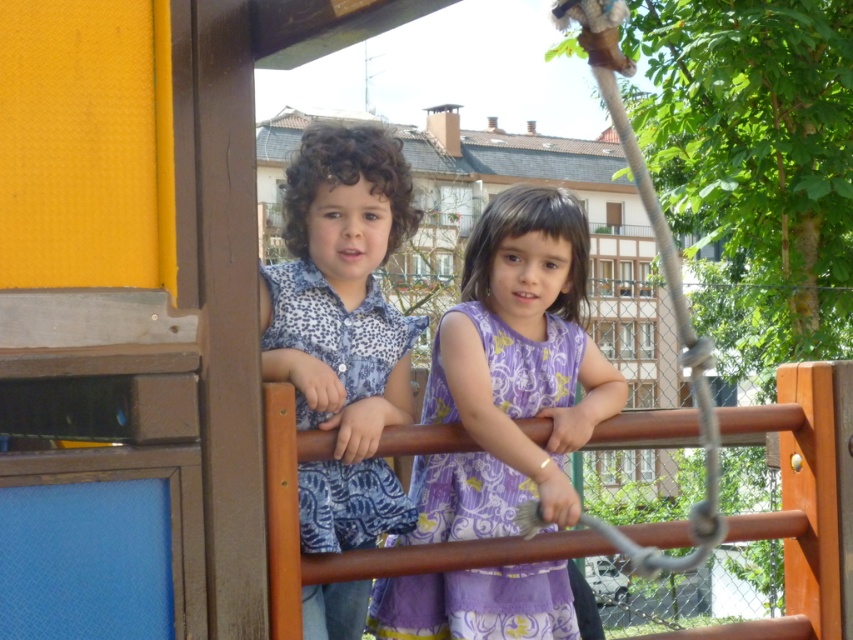
Does blue patterned shirt at center have a greater width compared to purple floral fabric dress at center?

No, blue patterned shirt at center is not wider than purple floral fabric dress at center.

Does blue patterned shirt at center appear over purple floral fabric dress at center?

Indeed, blue patterned shirt at center is positioned over purple floral fabric dress at center.

Is point (310, 509) positioned before point (422, 509)?

Yes, it is.

Where is `blue patterned shirt at center`? blue patterned shirt at center is located at coordinates (343, 326).